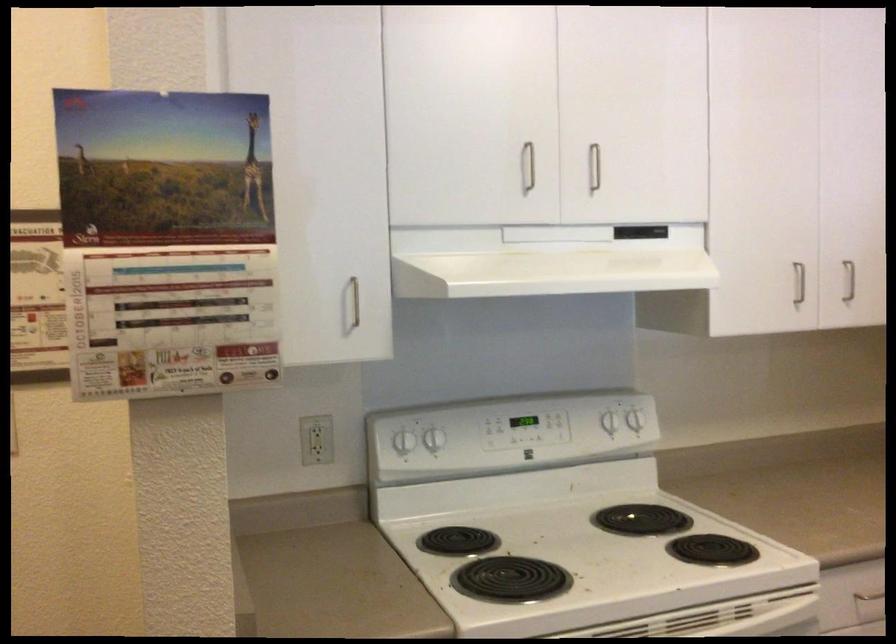
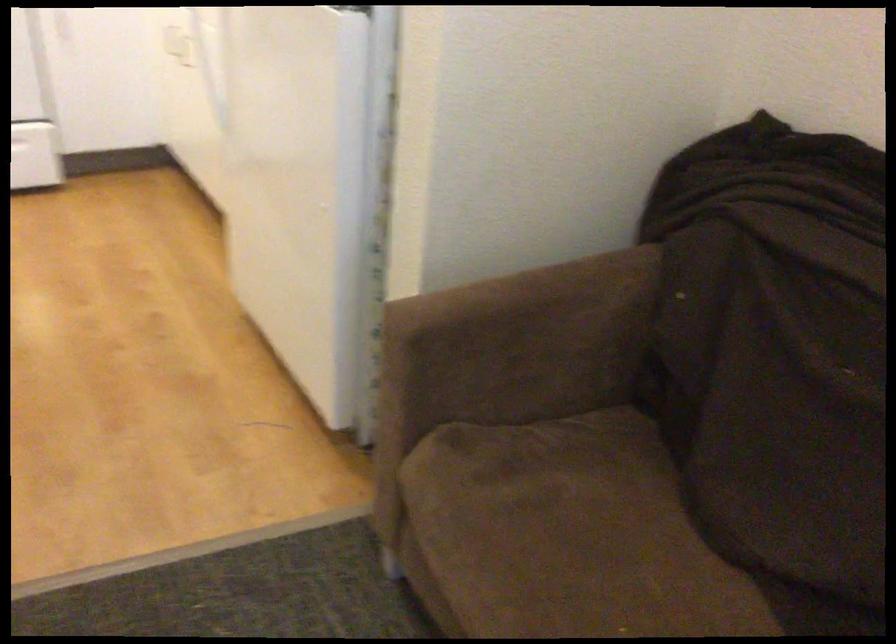
In a continuous first-person perspective shot, in which direction is the camera moving?

The movement direction of the cameraman is right, backward.